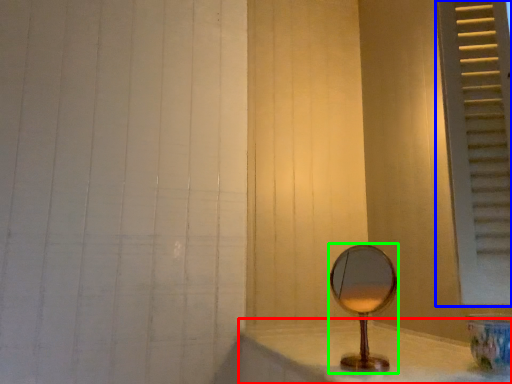
Question: Which object is positioned farthest from counter top (highlighted by a red box)? Select from window frame (highlighted by a blue box) and mirror (highlighted by a green box).

Choices:
 (A) window frame
 (B) mirror

Answer: (A)